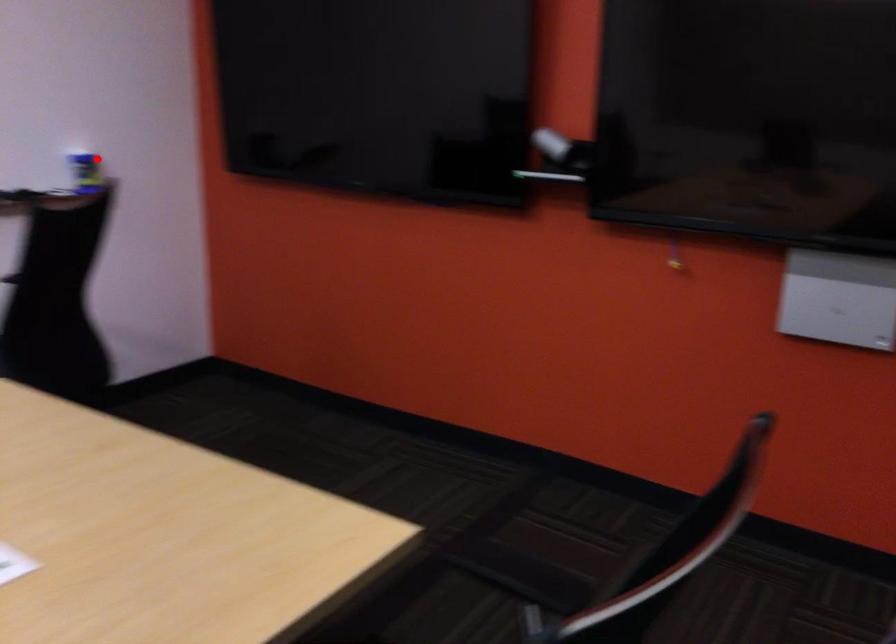
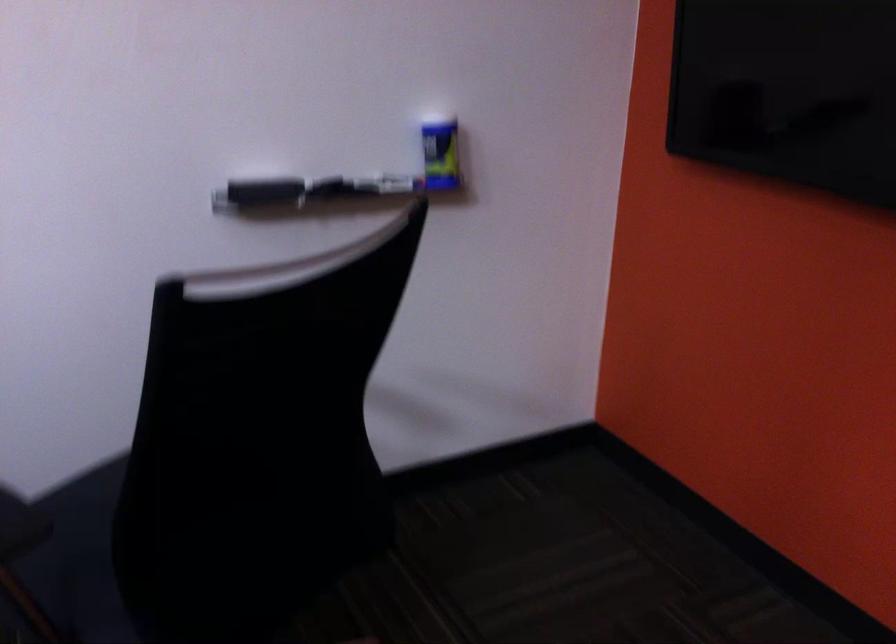
Question: I am providing you with two images of the same scene from different viewpoints. Image1 has a red point marked. In image2, the corresponding 3D location appears at what relative position? Reply with the corresponding letter.

Choices:
 (A) Closer
 (B) Farther

Answer: (A)